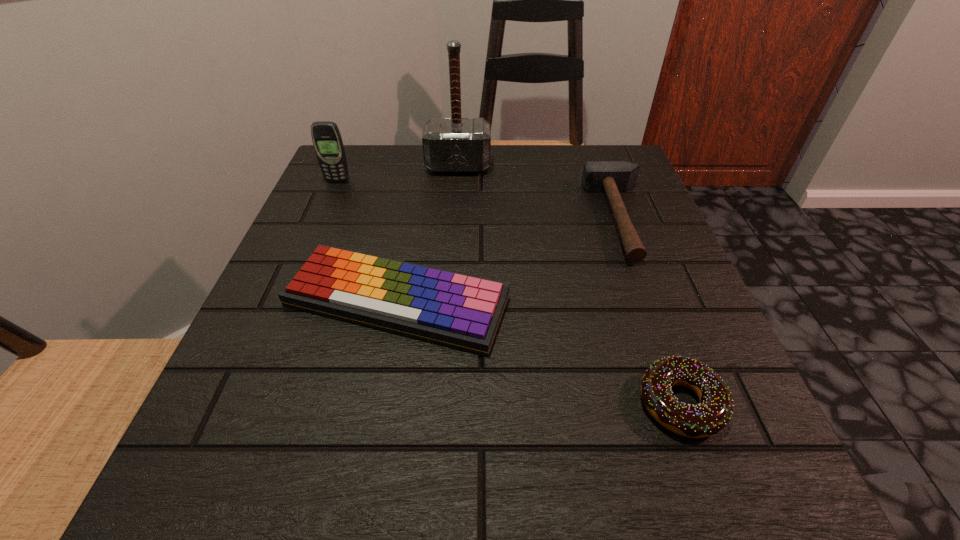
Identify the location of free spot located 0.390m on the striking surface of the right hammer. (396, 218).

This screenshot has width=960, height=540. In order to click on vacant space positioned on the striking surface of the right hammer in this screenshot , I will do `click(452, 218)`.

The width and height of the screenshot is (960, 540). Find the location of `blank space located 0.280m on the back of the computer keyboard`. blank space located 0.280m on the back of the computer keyboard is located at coordinates click(x=420, y=176).

Where is `vacant area situated 0.110m on the left of the doughnut`? The image size is (960, 540). vacant area situated 0.110m on the left of the doughnut is located at coordinates (555, 403).

Where is `cellular telephone present at the far edge`? This screenshot has height=540, width=960. cellular telephone present at the far edge is located at coordinates (326, 137).

Identify the location of object that is at the near edge. The height and width of the screenshot is (540, 960). (713, 413).

Image resolution: width=960 pixels, height=540 pixels. What are the coordinates of `cellular telephone situated at the left edge` in the screenshot? It's located at (326, 137).

This screenshot has width=960, height=540. What are the coordinates of `computer keyboard situated at the left edge` in the screenshot? It's located at (461, 311).

At what (x,y) coordinates should I click in order to perform the action: click on hammer at the right edge. Please return your answer as a coordinate pair (x, y). Image resolution: width=960 pixels, height=540 pixels. Looking at the image, I should click on (612, 177).

You are a GUI agent. You are given a task and a screenshot of the screen. Output one action in this format:
    pyautogui.click(x=<x>, y=<y>)
    Task: Click on the doughnut located in the right edge section of the desktop
    This screenshot has height=540, width=960.
    Given the screenshot: What is the action you would take?
    pyautogui.click(x=713, y=413)